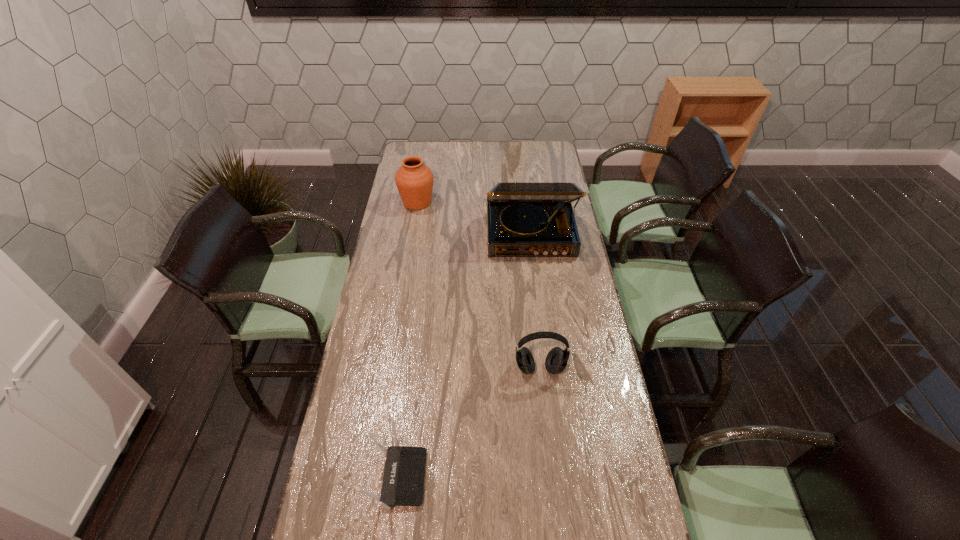
Where is `the tallest object`? The width and height of the screenshot is (960, 540). the tallest object is located at coordinates (524, 219).

This screenshot has width=960, height=540. In order to click on record player in this screenshot , I will do `click(524, 219)`.

You are a GUI agent. You are given a task and a screenshot of the screen. Output one action in this format:
    pyautogui.click(x=<x>, y=<y>)
    Task: Click on the urn
    
    Given the screenshot: What is the action you would take?
    pyautogui.click(x=414, y=180)

This screenshot has height=540, width=960. I want to click on the second tallest object, so click(414, 180).

Where is `the second shortest object`? The height and width of the screenshot is (540, 960). the second shortest object is located at coordinates (556, 361).

The image size is (960, 540). In order to click on the third farthest object in this screenshot , I will do `click(556, 361)`.

Image resolution: width=960 pixels, height=540 pixels. Identify the location of the shortest object. (403, 481).

The width and height of the screenshot is (960, 540). Find the location of `router`. router is located at coordinates (403, 481).

Locate an element on the screen. The width and height of the screenshot is (960, 540). free space located 0.360m on the front-facing side of the tallest object is located at coordinates (541, 331).

In order to click on free space located on the right of the farthest object in this screenshot , I will do `click(513, 202)`.